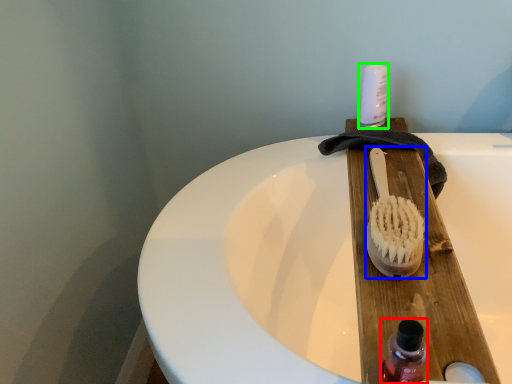
Question: Considering the real-world distances, which object is farthest from bottle (highlighted by a red box)? brush (highlighted by a blue box) or toiletry (highlighted by a green box)?

Choices:
 (A) brush
 (B) toiletry

Answer: (B)